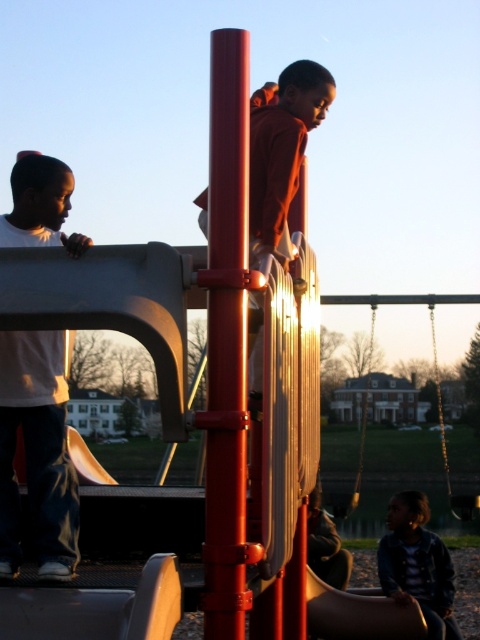
Does point (287, 132) lie behind point (434, 632)?

No, it is in front of (434, 632).

Where is `matte orange hoodie at center`? This screenshot has width=480, height=640. matte orange hoodie at center is located at coordinates (282, 150).

Is wooden swing at right smaller than orange matte slide at center?

No, wooden swing at right is not smaller than orange matte slide at center.

Consider the image. Is wooden swing at right positioned in front of orange matte slide at center?

No.

Who is more forward, (x=362, y=403) or (x=99, y=477)?

Point (x=99, y=477)

Identify the location of wooden swing at right. This screenshot has height=640, width=480. (361, 420).

Can you confirm if matte orange hoodie at center is bigger than orange matte slide at center?

Yes, matte orange hoodie at center is bigger than orange matte slide at center.

Between point (305, 132) and point (68, 436), which one is positioned behind?

The point (305, 132) is more distant.

Find the location of a particular element. The height and width of the screenshot is (640, 480). matte orange hoodie at center is located at coordinates (282, 150).